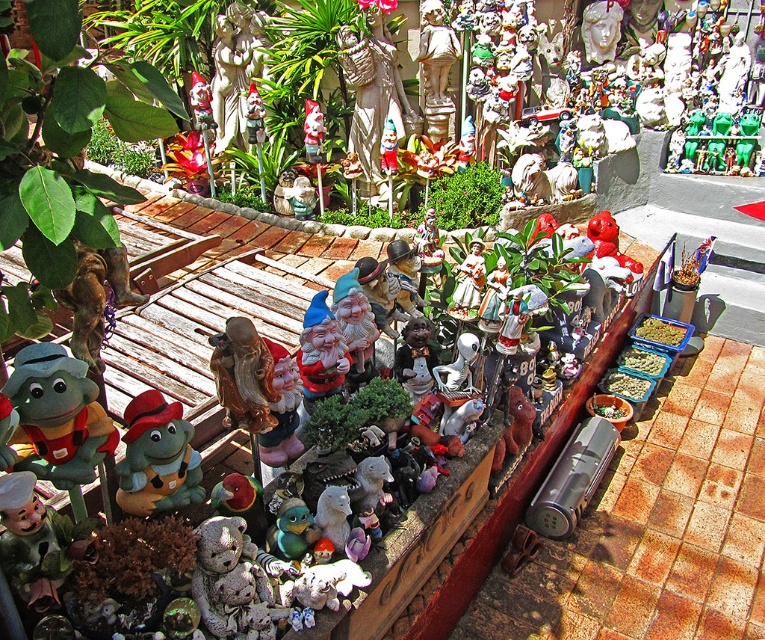
Which is in front, point (158, 506) or point (474, 298)?

Positioned in front is point (158, 506).

Does point (134, 496) come in front of point (477, 282)?

That is True.

You are a GUI agent. You are given a task and a screenshot of the screen. Output one action in this format:
    pyautogui.click(x=<x>, y=<y>)
    Task: Click on the plush green toy at center
    The image size is (765, 640).
    Given the screenshot: What is the action you would take?
    pyautogui.click(x=158, y=458)

Is green plush frog at left behind plush green toy at center?

No, it is not.

Is point (82, 433) positioned after point (137, 486)?

That is False.

At what (x,y) coordinates should I click in order to perform the action: click on green plush frog at left. Please return your answer as a coordinate pair (x, y). This screenshot has height=640, width=765. Looking at the image, I should click on (59, 419).

Is green plush frog at left wider than matte white figurine at center?

Yes.

Who is positioned more to the left, green plush frog at left or matte white figurine at center?

Positioned to the left is green plush frog at left.

Where is `green plush frog at left`? The height and width of the screenshot is (640, 765). green plush frog at left is located at coordinates (59, 419).